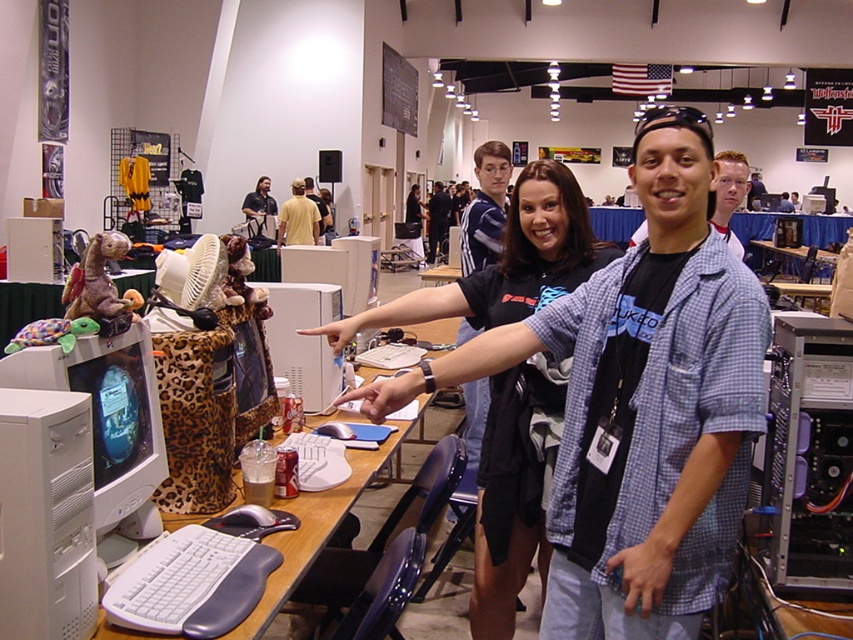
Which of these two, dark brown leather jacket at upper center or black shirt at center, stands taller?

dark brown leather jacket at upper center

Is dark brown leather jacket at upper center thinner than black shirt at center?

No, dark brown leather jacket at upper center is not thinner than black shirt at center.

Does point (254, 195) lie behind point (415, 205)?

That is False.

At what (x,y) coordinates should I click in order to perform the action: click on dark brown leather jacket at upper center. Please return your answer as a coordinate pair (x, y). The height and width of the screenshot is (640, 853). Looking at the image, I should click on (258, 205).

This screenshot has width=853, height=640. In order to click on wooden table at center in this screenshot , I will do `click(320, 524)`.

Is wooden table at center below white plastic desktop computer at center?

Yes.

Which is in front, point (416, 432) or point (315, 316)?

Point (315, 316) is more forward.

This screenshot has width=853, height=640. Identify the location of wooden table at center. (320, 524).

Does yellow t-shirt at center appear under matte black monitor at center?

Correct, yellow t-shirt at center is located below matte black monitor at center.

Between point (281, 237) and point (761, 200), which one is positioned in front?

Positioned in front is point (281, 237).

The image size is (853, 640). What are the coordinates of `yellow t-shirt at center` in the screenshot? It's located at (299, 218).